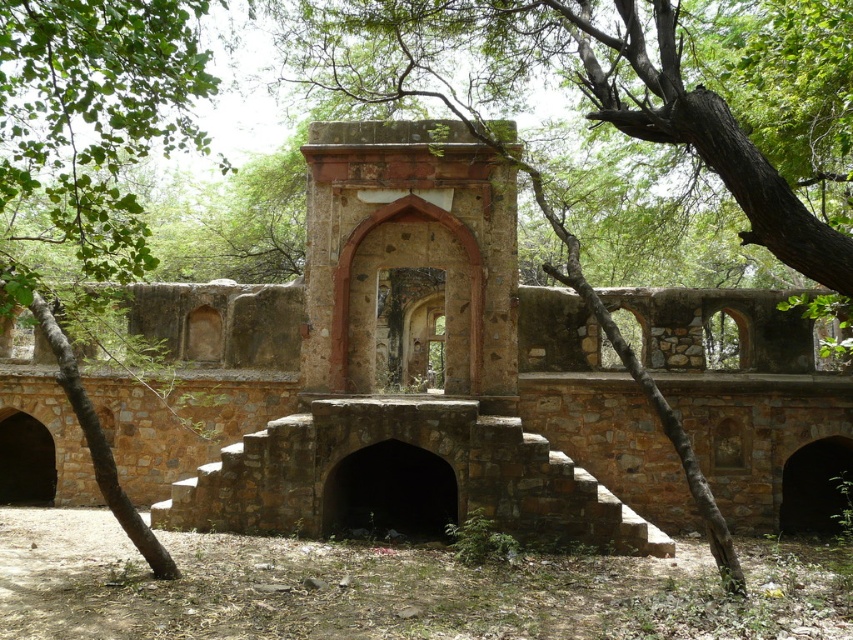
Question: Among these points, which one is farthest from the camera?

Choices:
 (A) (402, 248)
 (B) (7, 193)

Answer: (A)

Question: Is brown stone ruins at center wider than brown rough stone arch at center?

Choices:
 (A) no
 (B) yes

Answer: (B)

Question: Which of the following is the farthest from the observer?

Choices:
 (A) brown stone ruins at center
 (B) green leafy tree at left

Answer: (A)

Question: In this image, where is brown stone ruins at center located relative to brown rough stone arch at center?

Choices:
 (A) below
 (B) above

Answer: (A)

Question: Does brown stone ruins at center lie in front of green leafy tree at left?

Choices:
 (A) yes
 (B) no

Answer: (B)

Question: Which of the following is the closest to the observer?

Choices:
 (A) brown stone ruins at center
 (B) green leafy tree at left

Answer: (B)